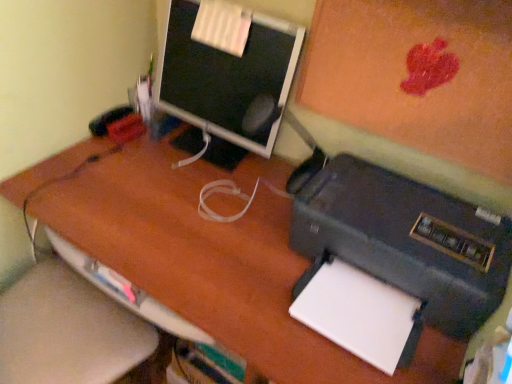
Question: Is matte black monitor at upper center oriented towards black matte printer at lower right?

Choices:
 (A) no
 (B) yes

Answer: (A)

Question: Is matte black monitor at upper center positioned behind black matte printer at lower right?

Choices:
 (A) yes
 (B) no

Answer: (A)

Question: From a real-world perspective, is matte black monitor at upper center under black matte printer at lower right?

Choices:
 (A) yes
 (B) no

Answer: (B)

Question: Is matte black monitor at upper center to the left of black matte printer at lower right from the viewer's perspective?

Choices:
 (A) yes
 (B) no

Answer: (A)

Question: Is matte black monitor at upper center touching black matte printer at lower right?

Choices:
 (A) no
 (B) yes

Answer: (A)

Question: Considering the positions of matte orange bulletin board at upper right and white paper at lower right in the image, is matte orange bulletin board at upper right wider or thinner than white paper at lower right?

Choices:
 (A) wide
 (B) thin

Answer: (B)

Question: Is matte orange bulletin board at upper right taller or shorter than white paper at lower right?

Choices:
 (A) tall
 (B) short

Answer: (A)

Question: In the image, is matte orange bulletin board at upper right positioned in front of or behind white paper at lower right?

Choices:
 (A) behind
 (B) front

Answer: (B)

Question: Is point (334, 102) closer or farther from the camera than point (333, 327)?

Choices:
 (A) farther
 (B) closer

Answer: (A)

Question: From a real-world perspective, relative to matte black monitor at upper center, is matte orange bulletin board at upper right vertically above or below?

Choices:
 (A) above
 (B) below

Answer: (A)

Question: From the image's perspective, is matte orange bulletin board at upper right positioned above or below matte black monitor at upper center?

Choices:
 (A) above
 (B) below

Answer: (B)

Question: Is matte orange bulletin board at upper right to the left or to the right of matte black monitor at upper center in the image?

Choices:
 (A) right
 (B) left

Answer: (A)

Question: Is matte orange bulletin board at upper right inside the boundaries of matte black monitor at upper center, or outside?

Choices:
 (A) outside
 (B) inside

Answer: (A)

Question: Relative to white paper at lower right, is black matte printer at lower right in front or behind?

Choices:
 (A) behind
 (B) front

Answer: (B)

Question: From a real-world perspective, is black matte printer at lower right above or below white paper at lower right?

Choices:
 (A) above
 (B) below

Answer: (A)